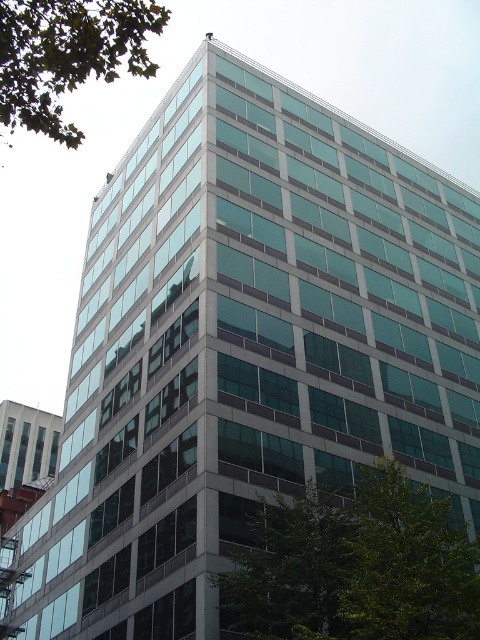
Question: Among these objects, which one is nearest to the camera?

Choices:
 (A) green leafy tree at lower right
 (B) green leafy tree at upper left

Answer: (B)

Question: Among these objects, which one is farthest from the camera?

Choices:
 (A) green leafy tree at upper left
 (B) green leafy tree at lower right

Answer: (B)

Question: Is green leafy tree at lower right thinner than green leafy tree at upper left?

Choices:
 (A) no
 (B) yes

Answer: (B)

Question: Is green leafy tree at lower right bigger than green leafy tree at upper left?

Choices:
 (A) yes
 (B) no

Answer: (B)

Question: Considering the relative positions of green leafy tree at lower right and green leafy tree at upper left in the image provided, where is green leafy tree at lower right located with respect to green leafy tree at upper left?

Choices:
 (A) right
 (B) left

Answer: (A)